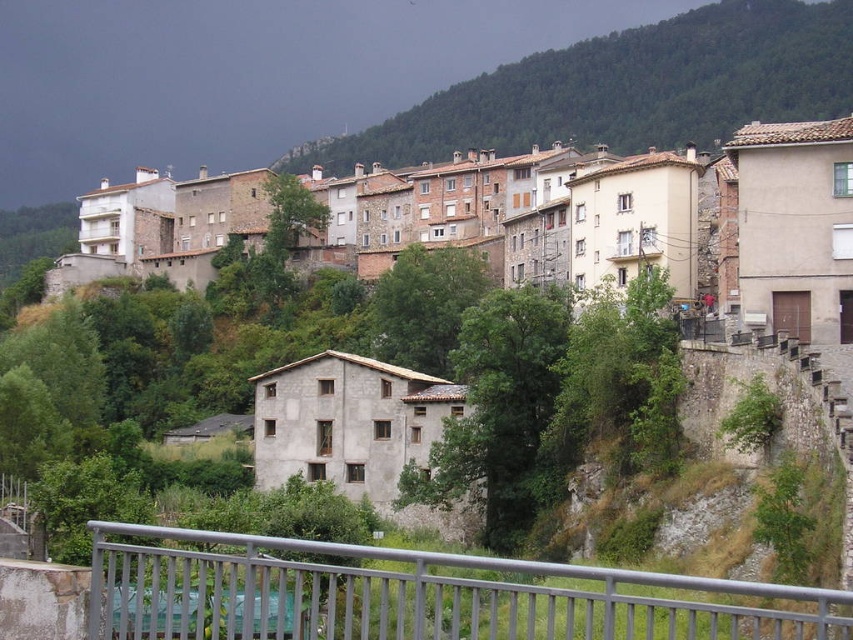
You are standing on a bridge overlooking a hillside town. You notice a point marked at coordinates [538,216]. What is located at this point?

The point at [538,216] marks stone houses at upper center.

Looking at this image, you are standing on a bridge overlooking the hillside town. You notice the stone houses at upper center and the silver metallic railing at lower center. Which object is positioned to the left when looking from your vantage point?

The stone houses at upper center are to the left of the silver metallic railing at lower center.